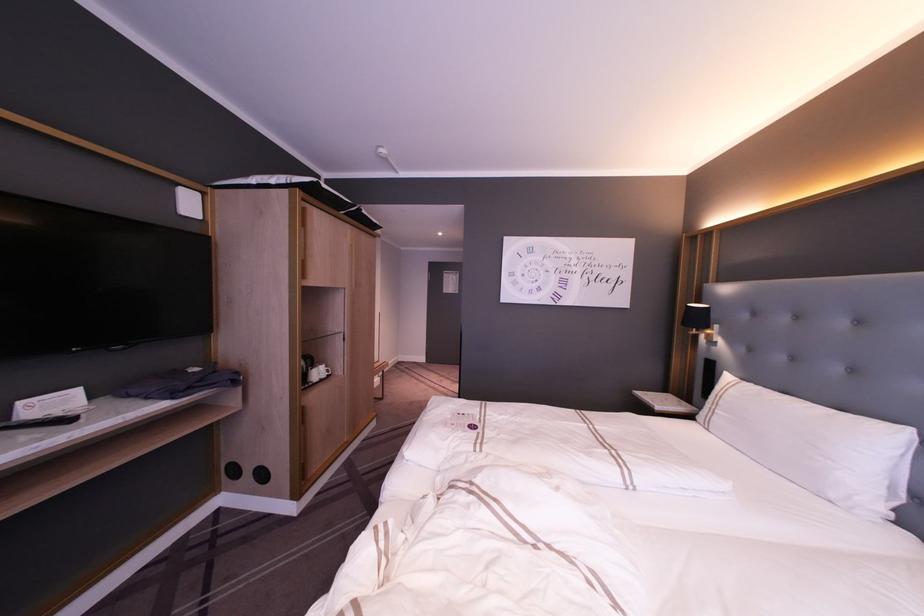
Find the location of a particular element. black kettle handle is located at coordinates (307, 360).